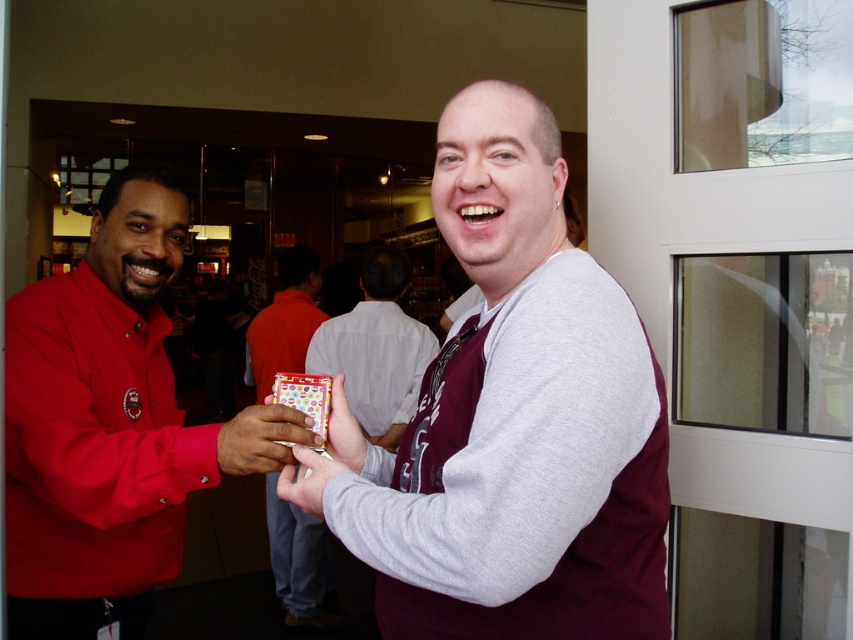
Can you confirm if metallic card at center is positioned below matte plastic card at center?

No.

Consider the image. Is metallic card at center thinner than matte plastic card at center?

Incorrect, metallic card at center's width is not less than matte plastic card at center's.

Describe the element at coordinates (285, 321) in the screenshot. This screenshot has height=640, width=853. I see `metallic card at center` at that location.

Identify the location of metallic card at center. The height and width of the screenshot is (640, 853). (285, 321).

Does matte red shirt at left appear over light gray cotton shirt at center?

Correct, matte red shirt at left is located above light gray cotton shirt at center.

Is matte red shirt at left closer to camera compared to light gray cotton shirt at center?

Yes, it is.

Who is more distant from viewer, [9,637] or [370,260]?

Positioned behind is point [370,260].

You are a GUI agent. You are given a task and a screenshot of the screen. Output one action in this format:
    pyautogui.click(x=<x>, y=<y>)
    Task: Click on the matte red shirt at left
    This screenshot has width=853, height=640.
    Given the screenshot: What is the action you would take?
    pyautogui.click(x=109, y=426)

Who is lower down, maroon tie at center or matte red shirt at left?

matte red shirt at left is below.

Describe the element at coordinates (518, 419) in the screenshot. I see `maroon tie at center` at that location.

Where is `maroon tie at center`? The height and width of the screenshot is (640, 853). maroon tie at center is located at coordinates (518, 419).